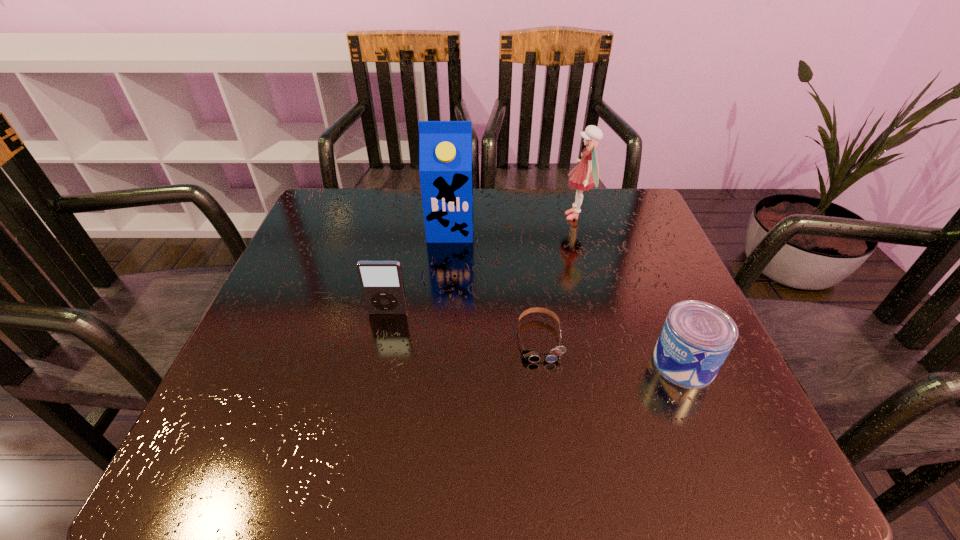
Identify the location of free space located on the front-facing side of the doll. Image resolution: width=960 pixels, height=540 pixels. (465, 216).

I want to click on free space located on the front-facing side of the doll, so click(449, 216).

This screenshot has width=960, height=540. Find the location of `free space located 0.300m on the front-facing side of the iPod`. free space located 0.300m on the front-facing side of the iPod is located at coordinates coord(355,464).

The width and height of the screenshot is (960, 540). I want to click on free point located 0.100m on the front label of the can, so click(597, 363).

Where is `vacant space located 0.140m on the front label of the can`? This screenshot has width=960, height=540. vacant space located 0.140m on the front label of the can is located at coordinates (575, 363).

I want to click on blank space located 0.180m on the front label of the can, so click(x=552, y=363).

This screenshot has width=960, height=540. Identify the location of free region located on the front-facing side of the shortest object. (551, 425).

Find the location of a particular element. This screenshot has width=960, height=540. carton at the far edge is located at coordinates (445, 147).

You are a GUI agent. You are given a task and a screenshot of the screen. Output one action in this format:
    pyautogui.click(x=<x>, y=<y>)
    Task: Click on the doll that is at the far edge
    The height and width of the screenshot is (540, 960).
    Given the screenshot: What is the action you would take?
    pyautogui.click(x=586, y=174)

Where is `doll that is at the right edge`? This screenshot has width=960, height=540. doll that is at the right edge is located at coordinates (586, 174).